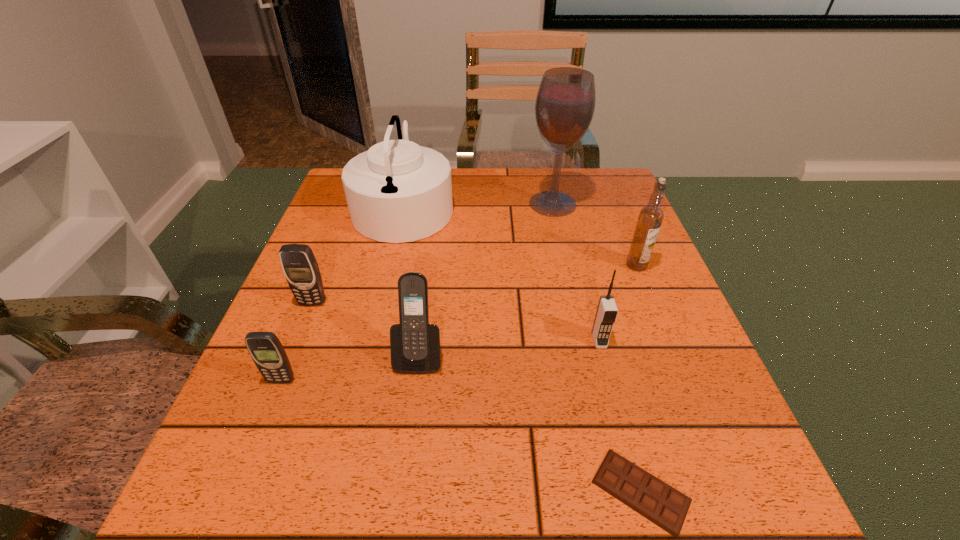
This screenshot has width=960, height=540. I want to click on free space between the seventh tallest object and the second cellular telephone from right to left, so click(x=350, y=368).

Where is `vacant space in between the fourth farthest object and the second cellular telephone from right to left`? vacant space in between the fourth farthest object and the second cellular telephone from right to left is located at coordinates (366, 328).

The image size is (960, 540). Find the location of `free space between the third cellular telephone from left to right and the vodka`. free space between the third cellular telephone from left to right and the vodka is located at coordinates (528, 310).

This screenshot has width=960, height=540. I want to click on free space between the kettle and the seventh tallest object, so click(x=343, y=294).

Locate an element on the screen. free space between the second cellular telephone from right to left and the sixth nearest object is located at coordinates (528, 310).

Identify the location of the third closest object to the fifth nearest object. (397, 191).

Locate which object is the seventh closest to the seventh tallest object. Please provide its 2D coordinates. Your answer should be formatted as a tuple, i.e. [(x, y)], where the tuple contains the x and y coordinates of a point satisfying the conditions above.

[(650, 218)]

Select which cellular telephone is the third closest to the nearest object. Please provide its 2D coordinates. Your answer should be formatted as a tuple, i.e. [(x, y)], where the tuple contains the x and y coordinates of a point satisfying the conditions above.

[(267, 352)]

The image size is (960, 540). Find the location of `cellular telephone identified as the second closest to the rightmost cellular telephone`. cellular telephone identified as the second closest to the rightmost cellular telephone is located at coordinates (300, 267).

This screenshot has height=540, width=960. Identify the location of vacant space that satisfies the following two spatial constraints: 1. on the spout of the nearest object; 2. on the left side of the kettle. (339, 491).